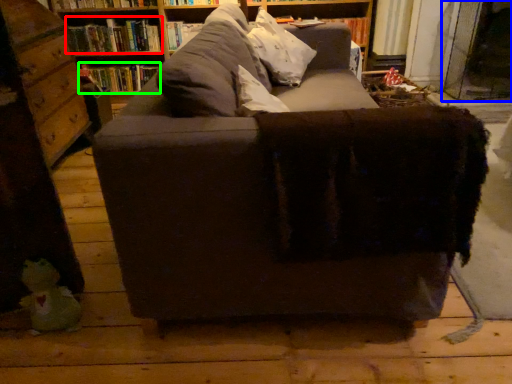
Question: Considering the real-world distances, which object is farthest from book (highlighted by a red box)? glass door (highlighted by a blue box) or book (highlighted by a green box)?

Choices:
 (A) glass door
 (B) book

Answer: (A)